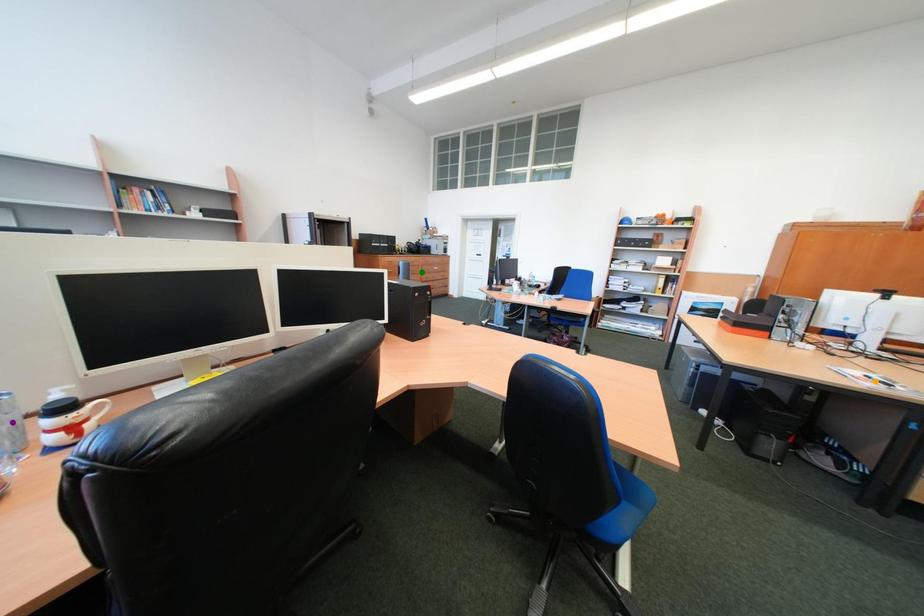
Order these from nearest to farthest:
- orange point
- purple point
- green point

green point → orange point → purple point